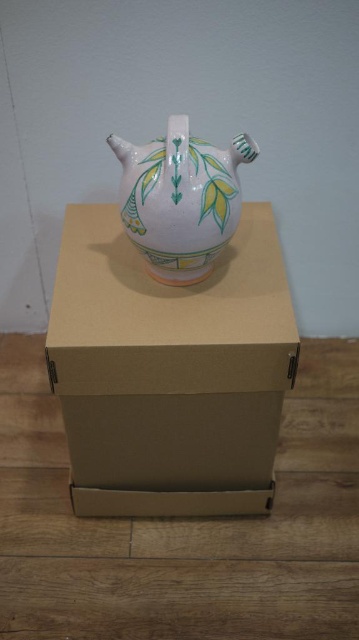
Looking at this image, you are standing in a room with a wooden floor and a light gray wall. You see a ceramic teapot on top of a brown cardboard box at center. Where is the point located at coordinates [170,371]?

The point at coordinates [170,371] is located on the brown cardboard box at center, which is beneath the ceramic teapot.

You are standing in front of the scene and want to determine which point is closer to you. The points are point (x=115, y=413) and point (x=173, y=232). Which point is closer?

Point (x=115, y=413) is further to the viewer than point (x=173, y=232), so point (x=173, y=232) is closer to you.